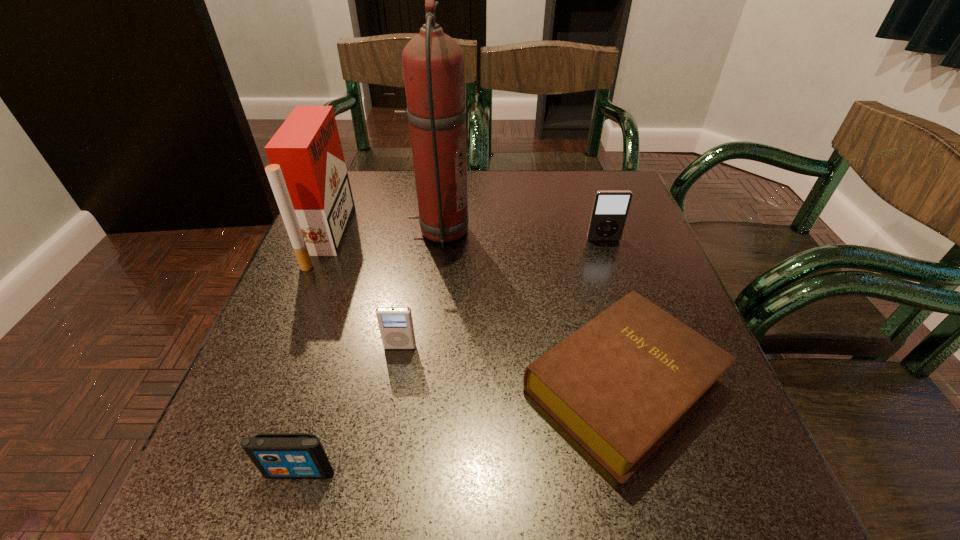
What are the coordinates of `free space at the far right corner` in the screenshot? It's located at (575, 179).

This screenshot has height=540, width=960. I want to click on vacant area between the third tallest object and the leftmost iPod, so click(451, 356).

Locate an element on the screen. This screenshot has width=960, height=540. unoccupied area between the nearest iPod and the second iPod from left to right is located at coordinates (349, 409).

This screenshot has width=960, height=540. I want to click on empty space between the fire extinguisher and the cigarette case, so pos(383,233).

Locate an element on the screen. free spot between the farthest iPod and the second farthest iPod is located at coordinates (502, 293).

Find the location of a particular element. free area in between the third tallest object and the leftmost iPod is located at coordinates (451, 356).

Identify the location of vacant area that lies between the second tallest object and the farthest iPod. (466, 238).

Find the location of a particular element. Image resolution: width=960 pixels, height=540 pixels. vacant area between the second tallest object and the third tallest object is located at coordinates (466, 238).

Find the location of `free space between the fifth object from right to left and the shortest object`. free space between the fifth object from right to left and the shortest object is located at coordinates 461,428.

The width and height of the screenshot is (960, 540). Identify the location of free space between the fire extinguisher and the second object from left to right. (370, 352).